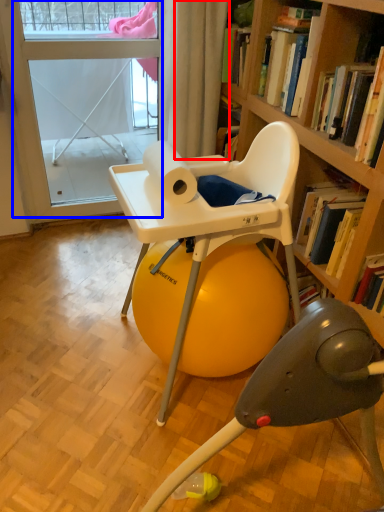
Question: Among these objects, which one is farthest to the camera, curtain (highlighted by a red box) or screen door (highlighted by a blue box)?

Choices:
 (A) curtain
 (B) screen door

Answer: (B)